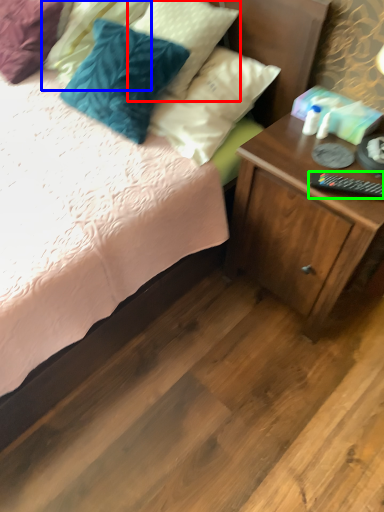
Question: Estimate the real-world distances between objects in this image. Which object is closer to pillow (highlighted by a red box), pillow (highlighted by a blue box) or remote control (highlighted by a green box)?

Choices:
 (A) pillow
 (B) remote control

Answer: (A)